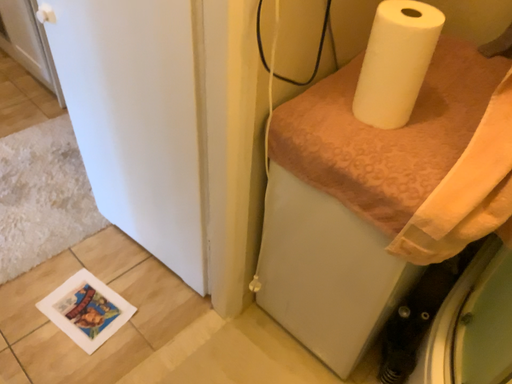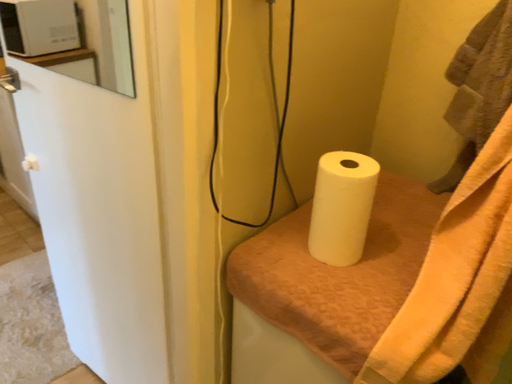
Question: How did the camera likely rotate when shooting the video?

Choices:
 (A) rotated upward
 (B) rotated downward

Answer: (A)